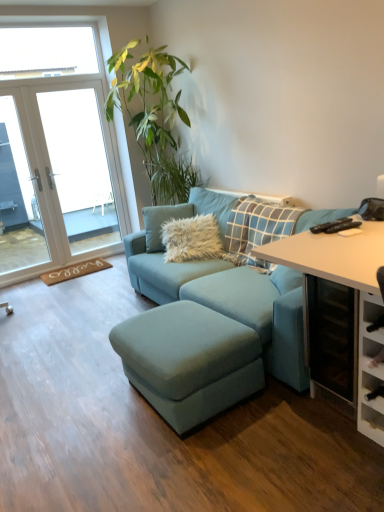
Question: Is fuzzy white pillow at center shorter than white glass door at upper left?

Choices:
 (A) no
 (B) yes

Answer: (B)

Question: Is the depth of fuzzy white pillow at center less than that of white glass door at upper left?

Choices:
 (A) yes
 (B) no

Answer: (A)

Question: Is fuzzy white pillow at center positioned with its back to white glass door at upper left?

Choices:
 (A) yes
 (B) no

Answer: (B)

Question: From a real-world perspective, is fuzzy white pillow at center physically above white glass door at upper left?

Choices:
 (A) no
 (B) yes

Answer: (A)

Question: Considering the relative positions of fuzzy white pillow at center and white glass door at upper left in the image provided, is fuzzy white pillow at center to the left of white glass door at upper left from the viewer's perspective?

Choices:
 (A) yes
 (B) no

Answer: (B)

Question: Is white glass door at left wider or thinner than suede blue studio couch at center?

Choices:
 (A) thin
 (B) wide

Answer: (A)

Question: Visually, is white glass door at left positioned to the left or to the right of suede blue studio couch at center?

Choices:
 (A) left
 (B) right

Answer: (A)

Question: Relative to suede blue studio couch at center, is white glass door at left in front or behind?

Choices:
 (A) front
 (B) behind

Answer: (B)

Question: Considering the positions of white glass door at left and suede blue studio couch at center in the image, is white glass door at left taller or shorter than suede blue studio couch at center?

Choices:
 (A) short
 (B) tall

Answer: (B)

Question: Is suede blue studio couch at center taller or shorter than white glossy table at right?

Choices:
 (A) tall
 (B) short

Answer: (A)

Question: From the image's perspective, is suede blue studio couch at center above or below white glossy table at right?

Choices:
 (A) below
 (B) above

Answer: (A)

Question: Is suede blue studio couch at center in front of or behind white glossy table at right in the image?

Choices:
 (A) behind
 (B) front

Answer: (B)

Question: Considering the positions of suede blue studio couch at center and white glossy table at right in the image, is suede blue studio couch at center bigger or smaller than white glossy table at right?

Choices:
 (A) big
 (B) small

Answer: (A)

Question: Looking at the image, does white glass door at upper left seem bigger or smaller compared to suede blue studio couch at center?

Choices:
 (A) big
 (B) small

Answer: (B)

Question: From their relative heights in the image, would you say white glass door at upper left is taller or shorter than suede blue studio couch at center?

Choices:
 (A) tall
 (B) short

Answer: (A)